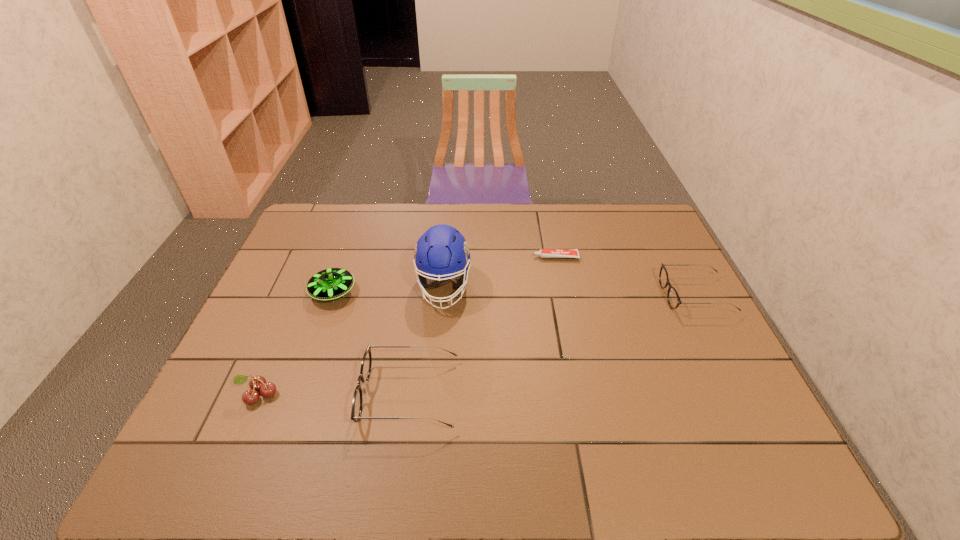
Find the location of `the taller spectacles`. the taller spectacles is located at coordinates (366, 364).

The image size is (960, 540). I want to click on the left spectacles, so click(x=366, y=364).

The height and width of the screenshot is (540, 960). Identify the location of the farther spectacles. (673, 299).

At what (x,y) coordinates should I click in order to perform the action: click on the shorter spectacles. Please return your answer as a coordinate pair (x, y). This screenshot has width=960, height=540. Looking at the image, I should click on (673, 299).

This screenshot has height=540, width=960. What are the coordinates of `the farthest object` in the screenshot? It's located at (543, 253).

Identify the location of toothpaste. (543, 253).

Where is `saucer`? saucer is located at coordinates (329, 284).

Find the location of a particular element. the tallest object is located at coordinates (442, 251).

The image size is (960, 540). What are the coordinates of `cherry` in the screenshot? It's located at (257, 383).

Where is `free point located 0.240m through the lenses of the nearer spectacles`? free point located 0.240m through the lenses of the nearer spectacles is located at coordinates (262, 394).